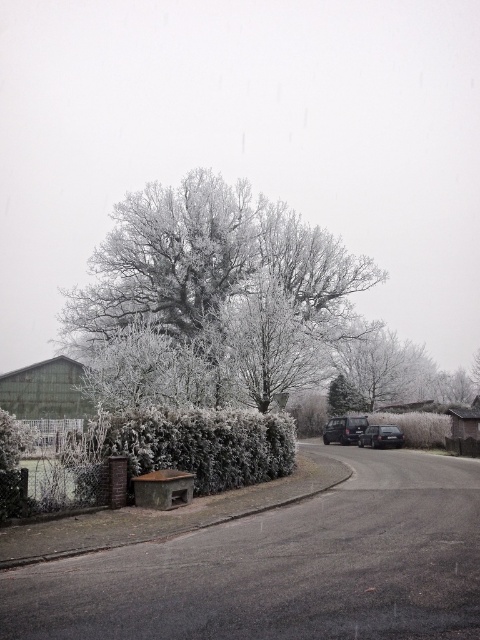
You are a pedestrian standing at the intersection and want to walk towards the white frosty tree at center. Is the dark gray metallic car at center blocking your path? Please explain why based on their positions.

The white frosty tree at center is further to the viewer than the dark gray metallic car at center. This means the tree is closer to you, so the car is behind the tree and not blocking your path.

You are a pedestrian standing on the paved road and want to walk to the dark gray metallic car at center. Which direction should you go to avoid the white frosty tree at center?

The white frosty tree at center is above the dark gray metallic car at center, so you should walk downward along the road to reach the dark gray metallic car at center without encountering the tree.